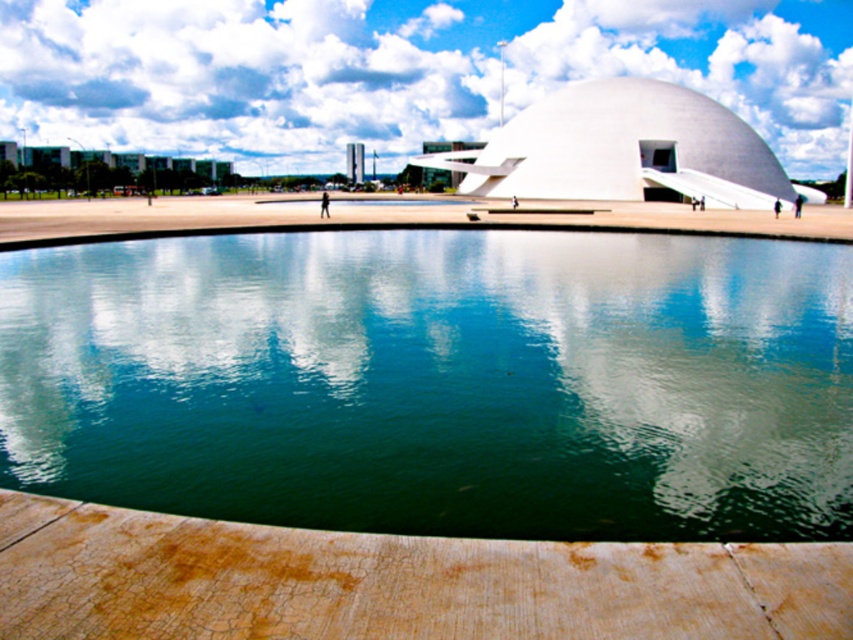
Is white cloud at upper center positioned behind white smooth dome at center?

Yes, it is.

Is white cloud at upper center wider than white smooth dome at center?

Yes, white cloud at upper center is wider than white smooth dome at center.

Is point (334, 58) closer to camera compared to point (723, 164)?

No.

Identify the location of white cloud at upper center. This screenshot has width=853, height=640. (401, 72).

Does point (799, 323) come closer to viewer compared to point (299, 42)?

Yes, point (799, 323) is closer to viewer.

Is green smooth water at center behind white cloud at upper center?

No, green smooth water at center is in front of white cloud at upper center.

Who is more distant from viewer, (158, 364) or (741, 77)?

The point (741, 77) is more distant.

In order to click on green smooth water at center in this screenshot , I will do `click(438, 381)`.

Is green smooth water at center thinner than white smooth dome at center?

Correct, green smooth water at center's width is less than white smooth dome at center's.

Between green smooth water at center and white smooth dome at center, which one is positioned higher?

Positioned higher is white smooth dome at center.

Between point (463, 467) and point (630, 140), which one is positioned in front?

Point (463, 467) is more forward.

This screenshot has height=640, width=853. Identify the location of green smooth water at center. (438, 381).